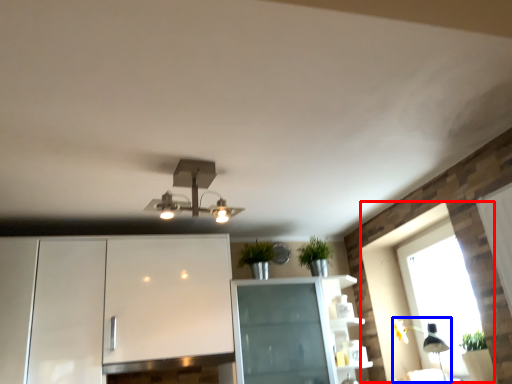
Question: Among these objects, which one is nearest to the camera, window (highlighted by a red box) or light fixture (highlighted by a blue box)?

Choices:
 (A) window
 (B) light fixture

Answer: (B)